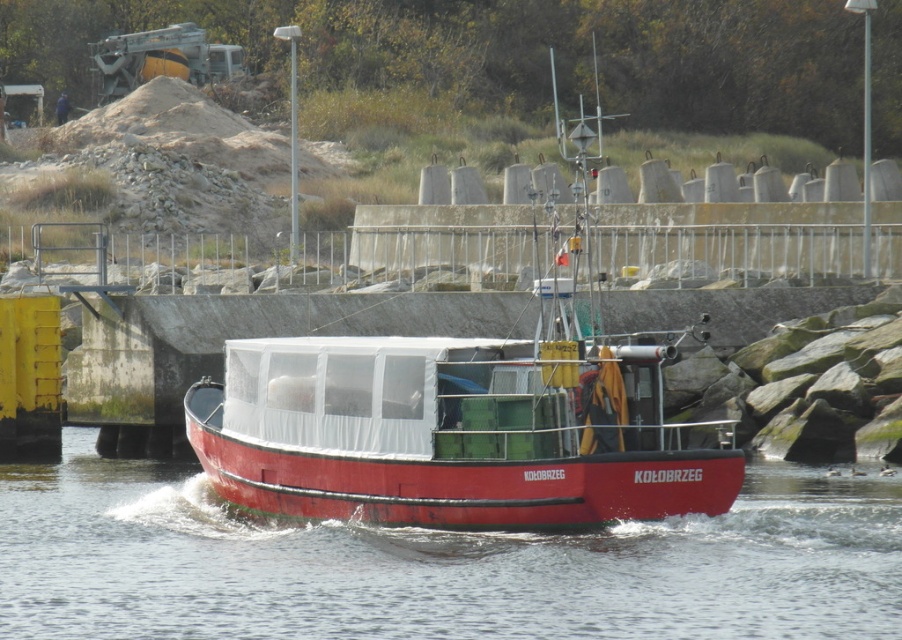
You are standing on the deck of the red fishing boat named KOLOBRZEG and looking towards the point marked at coordinate (x=437, y=564). What do you see at that location?

At point (x=437, y=564) lies transparent plastic water at center.

From the picture: You are on the red fishing boat named KOLOBRZEG and want to navigate towards a specific destination. You have two points marked on your map, point (719, 534) and point (339, 490). According to the scene, which point is closer to the boat?

Point (719, 534) is in front of point (339, 490), so it is closer to the boat.